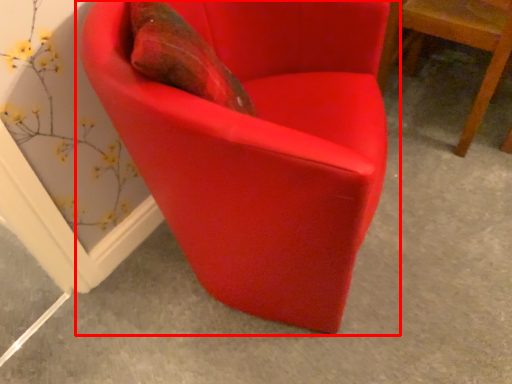
Question: In this image, where is chair (annotated by the red box) located relative to chair?

Choices:
 (A) right
 (B) left

Answer: (B)